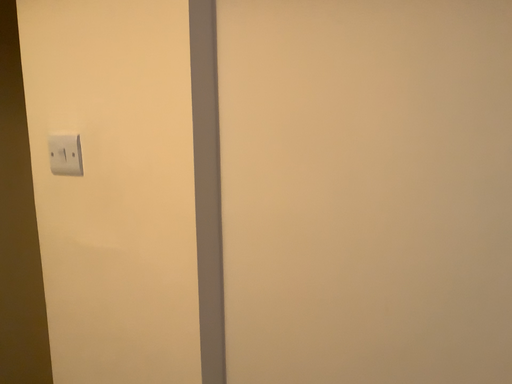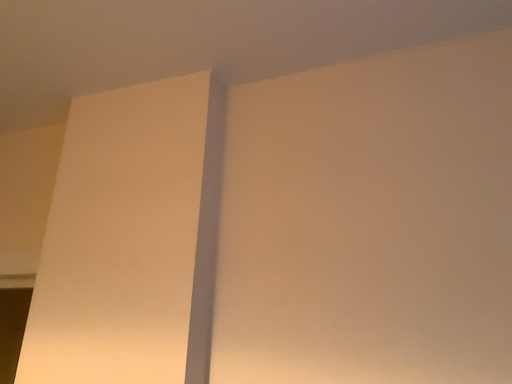
Question: How did the camera likely rotate when shooting the video?

Choices:
 (A) rotated downward
 (B) rotated upward

Answer: (B)